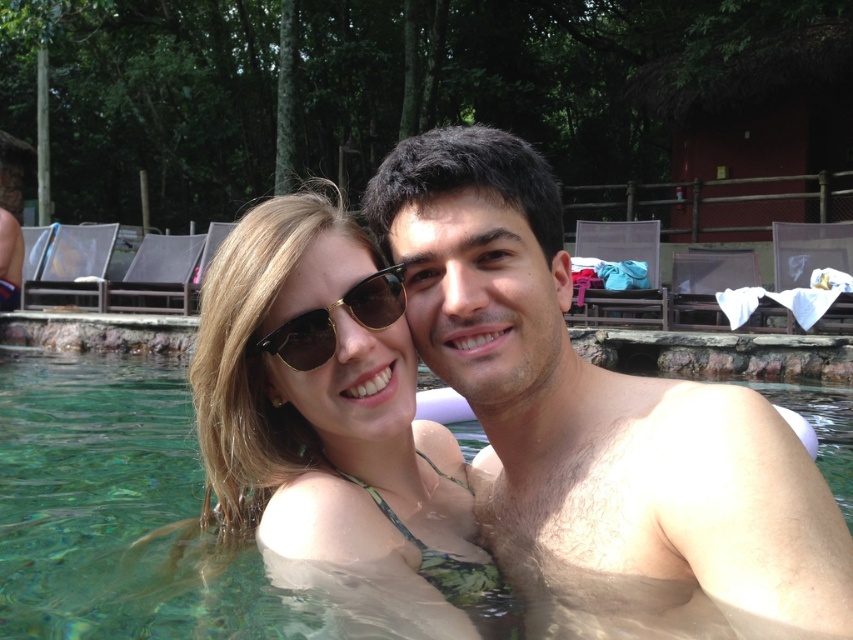
Question: Which point is farther to the camera?

Choices:
 (A) hairless skin at center
 (B) sunglasses at center
 (C) smooth skin man at center

Answer: (B)

Question: Which point appears closest to the camera in this image?

Choices:
 (A) (282, 486)
 (B) (691, 502)

Answer: (B)

Question: Can you confirm if smooth skin man at center is positioned to the right of matte green bikini top at center?

Choices:
 (A) yes
 (B) no

Answer: (A)

Question: Does smooth skin man at center have a smaller size compared to clear glass water at center?

Choices:
 (A) yes
 (B) no

Answer: (B)

Question: Is clear glass water at center to the left of sunglasses at center from the viewer's perspective?

Choices:
 (A) no
 (B) yes

Answer: (B)

Question: Which is nearer to the clear glass water at center?

Choices:
 (A) matte green bikini top at center
 (B) hairless skin at center
 (C) sunglasses at center
 (D) smooth skin man at center

Answer: (A)